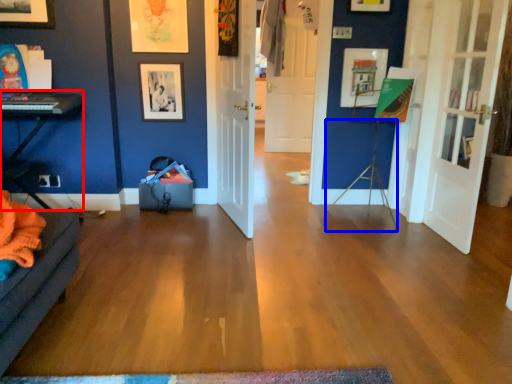
Question: Which point is closer to the camera, table (highlighted by a red box) or tripod (highlighted by a blue box)?

Choices:
 (A) table
 (B) tripod

Answer: (A)